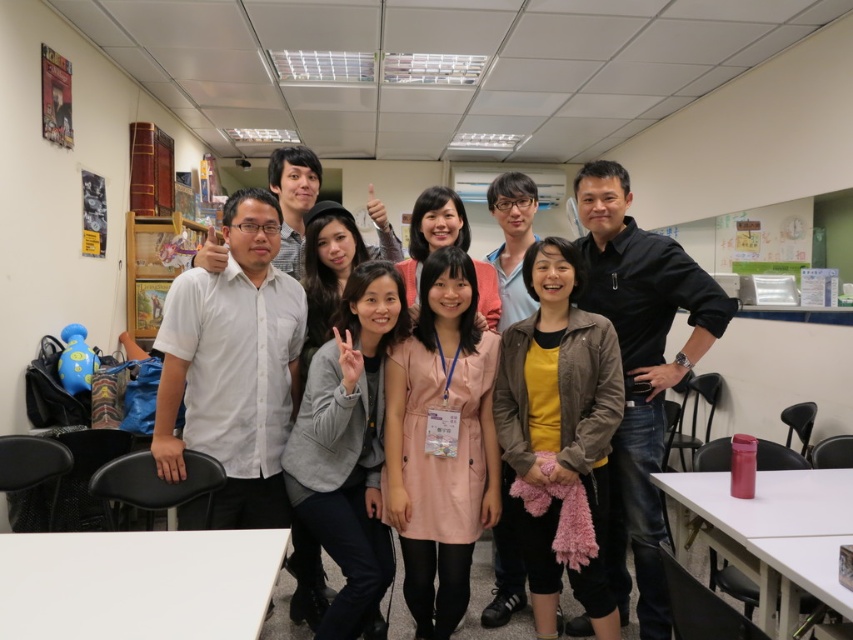
Question: Which point is farther to the camera?

Choices:
 (A) pink fabric dress at center
 (B) brown leather jacket at center
 (C) gray fabric jacket at center
 (D) pink fabric at center

Answer: (D)

Question: Where is pink fabric dress at center located in relation to wooden bookshelf at left in the image?

Choices:
 (A) below
 (B) above

Answer: (A)

Question: Considering the real-world distances, which object is farthest from the gray fabric jacket at center?

Choices:
 (A) pink fabric at center
 (B) pink fabric dress at center
 (C) brown leather jacket at center

Answer: (A)

Question: In this image, where is gray fabric jacket at center located relative to wooden bookshelf at left?

Choices:
 (A) below
 (B) above

Answer: (A)

Question: Can you confirm if brown leather jacket at center is wider than wooden bookshelf at left?

Choices:
 (A) no
 (B) yes

Answer: (A)

Question: Among these objects, which one is farthest from the camera?

Choices:
 (A) pink fabric dress at center
 (B) brown leather jacket at center
 (C) wooden bookshelf at left

Answer: (C)